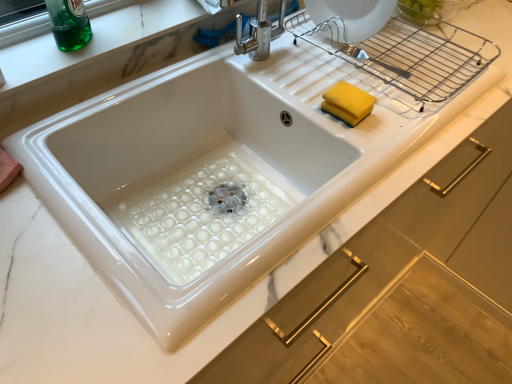
I want to click on vacant space behind green glass bottle at upper left, so click(114, 14).